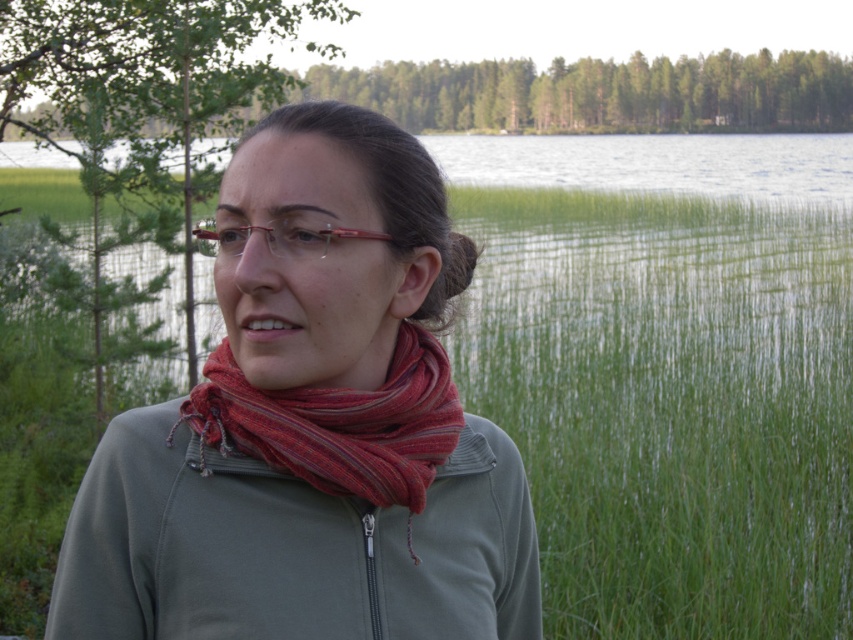
You are a hiker who wants to take a photo of the green leafy tree at center from where the green fleece sweatshirt at center is located. Considering the camera you have can focus up to 10 meters, will you be able to capture a clear photo of the tree?

The distance between the green fleece sweatshirt at center and the green leafy tree at center is 7.64 meters, which is within the camera focusing range of up to 10 meters. Therefore, you can take a clear photo of the green leafy tree at center from that location.

You are a photographer wanting to capture both the green fleece sweatshirt at center and the green leafy tree at center in a single frame. Which object should you focus on first to ensure both are in focus?

You should focus on the green leafy tree at center first because it is farther away than the green fleece sweatshirt at center, allowing both to be in focus when using a single focal point.

You are a photographer trying to capture the person wearing the matte green jacket at center in your shot. If you want to focus on the jacket, where should you aim your camera? Please provide coordinates in the format of a point like this example format, e.g., point at point 0.6, 0.4.

The matte green jacket at center is located at point (312, 429), so aim your camera at point (312, 429) to focus on it.